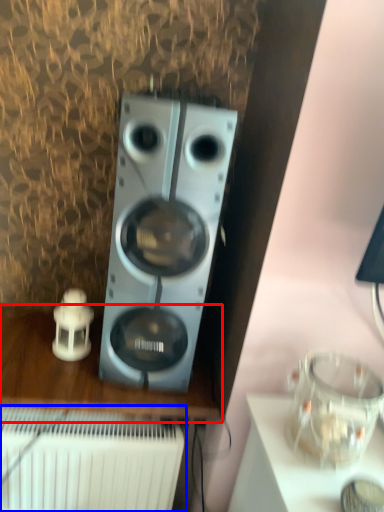
Question: Among these objects, which one is farthest to the camera, furniture (highlighted by a red box) or radiator (highlighted by a blue box)?

Choices:
 (A) furniture
 (B) radiator

Answer: (A)